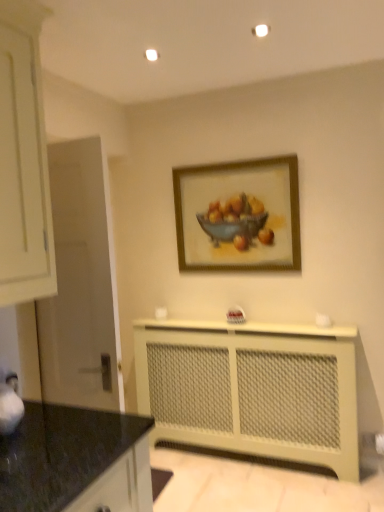
Image resolution: width=384 pixels, height=512 pixels. What do you see at coordinates (238, 214) in the screenshot?
I see `wooden frame at upper center` at bounding box center [238, 214].

You are a GUI agent. You are given a task and a screenshot of the screen. Output one action in this format:
    pyautogui.click(x=<x>, y=<y>)
    Task: Click on the black granite countertop at lower left
    
    Given the screenshot: What is the action you would take?
    pyautogui.click(x=76, y=461)

Would you say black granite countertop at lower left is outside wooden frame at upper center?

black granite countertop at lower left lies outside wooden frame at upper center's area.

Does black granite countertop at lower left come behind wooden frame at upper center?

No, it is not.

From a real-world perspective, is black granite countertop at lower left below wooden frame at upper center?

Yes, from a real-world perspective, black granite countertop at lower left is beneath wooden frame at upper center.

How much distance is there between beige mesh radiator at lower center and black granite countertop at lower left?

They are 4.96 feet apart.

Between beige mesh radiator at lower center and black granite countertop at lower left, which one has less height?

With less height is black granite countertop at lower left.

Is the surface of beige mesh radiator at lower center in direct contact with black granite countertop at lower left?

No.

Is beige mesh radiator at lower center to the left of black granite countertop at lower left from the viewer's perspective?

Incorrect, beige mesh radiator at lower center is not on the left side of black granite countertop at lower left.

In the scene shown: Considering the relative sizes of wooden frame at upper center and beige mesh radiator at lower center in the image provided, is wooden frame at upper center thinner than beige mesh radiator at lower center?

Yes.

Is wooden frame at upper center next to beige mesh radiator at lower center and touching it?

No.

The height and width of the screenshot is (512, 384). What are the coordinates of `counter located in front of the wooden frame at upper center` in the screenshot? It's located at (252, 389).

Is wooden frame at upper center at the right side of beige mesh radiator at lower center?

No, wooden frame at upper center is not to the right of beige mesh radiator at lower center.

From the image's perspective, would you say wooden frame at upper center is shown under black granite countertop at lower left?

Actually, wooden frame at upper center appears above black granite countertop at lower left in the image.

Measure the distance from wooden frame at upper center to black granite countertop at lower left.

wooden frame at upper center is 1.75 meters away from black granite countertop at lower left.

In the scene shown: Is the depth of wooden frame at upper center greater than that of black granite countertop at lower left?

That is True.

Is wooden frame at upper center placed right next to black granite countertop at lower left?

There is a gap between wooden frame at upper center and black granite countertop at lower left.

Is beige mesh radiator at lower center with wooden frame at upper center?

No, beige mesh radiator at lower center is not touching wooden frame at upper center.

From the image's perspective, which one is positioned higher, beige mesh radiator at lower center or wooden frame at upper center?

wooden frame at upper center is shown above in the image.

From the picture: Could you tell me if beige mesh radiator at lower center is turned towards wooden frame at upper center?

No, beige mesh radiator at lower center is not facing towards wooden frame at upper center.

What's the angular difference between beige mesh radiator at lower center and wooden frame at upper center's facing directions?

The facing directions of beige mesh radiator at lower center and wooden frame at upper center are 0.394 degrees apart.

From the image's perspective, is black granite countertop at lower left on beige mesh radiator at lower center?

Yes, from the image's perspective, black granite countertop at lower left is over beige mesh radiator at lower center.

Can beige mesh radiator at lower center be found inside black granite countertop at lower left?

No, beige mesh radiator at lower center is located outside of black granite countertop at lower left.

Can you tell me how much black granite countertop at lower left and beige mesh radiator at lower center differ in facing direction?

black granite countertop at lower left and beige mesh radiator at lower center are facing 90.3 degrees away from each other.

Could you tell me if black granite countertop at lower left is facing beige mesh radiator at lower center?

No, black granite countertop at lower left is not facing towards beige mesh radiator at lower center.

Locate an element on the screen. picture frame that appears above the black granite countertop at lower left (from a real-world perspective) is located at coordinates (238, 214).

In the image, there is a beige mesh radiator at lower center. Identify the location of countertop above it (from the image's perspective). Image resolution: width=384 pixels, height=512 pixels. (76, 461).

From the picture: From the image, which object appears to be nearer to beige mesh radiator at lower center, black granite countertop at lower left or wooden frame at upper center?

wooden frame at upper center lies closer to beige mesh radiator at lower center than the other object.

When comparing their distances from beige mesh radiator at lower center, does wooden frame at upper center or black granite countertop at lower left seem further?

black granite countertop at lower left.

Which object lies nearer to the anchor point wooden frame at upper center, black granite countertop at lower left or beige mesh radiator at lower center?

Among the two, beige mesh radiator at lower center is located nearer to wooden frame at upper center.

Looking at the image, which one is located closer to black granite countertop at lower left, wooden frame at upper center or beige mesh radiator at lower center?

The object closer to black granite countertop at lower left is beige mesh radiator at lower center.

Estimate the real-world distances between objects in this image. Which object is further from wooden frame at upper center, beige mesh radiator at lower center or black granite countertop at lower left?

Among the two, black granite countertop at lower left is located further to wooden frame at upper center.

Based on the photo, estimate the real-world distances between objects in this image. Which object is closer to black granite countertop at lower left, beige mesh radiator at lower center or wooden frame at upper center?

Based on the image, beige mesh radiator at lower center appears to be nearer to black granite countertop at lower left.

You are a GUI agent. You are given a task and a screenshot of the screen. Output one action in this format:
    pyautogui.click(x=<x>, y=<y>)
    Task: Click on the counter between black granite countertop at lower left and wooden frame at upper center along the z-axis
    The width and height of the screenshot is (384, 512).
    Given the screenshot: What is the action you would take?
    pyautogui.click(x=252, y=389)